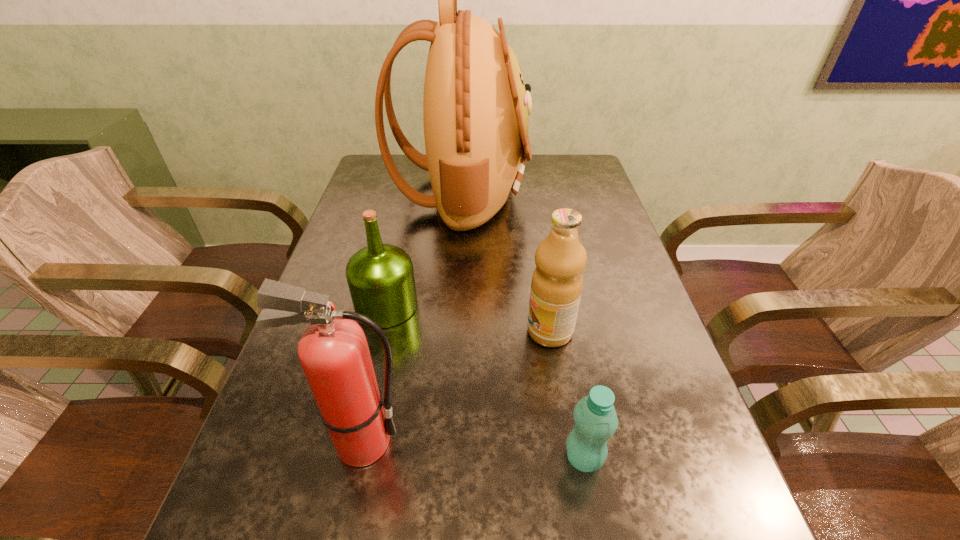
Where is `empty space that is in between the second tallest object and the bottle`? The width and height of the screenshot is (960, 540). empty space that is in between the second tallest object and the bottle is located at coordinates (472, 450).

You are a GUI agent. You are given a task and a screenshot of the screen. Output one action in this format:
    pyautogui.click(x=<x>, y=<y>)
    Task: Click on the free point between the third tallest object and the bottle
    This screenshot has height=540, width=960.
    Given the screenshot: What is the action you would take?
    pyautogui.click(x=566, y=395)

Select which object is the closest to the taller olive oil. Please provide its 2D coordinates. Your answer should be formatted as a tuple, i.e. [(x, y)], where the tuple contains the x and y coordinates of a point satisfying the conditions above.

[(596, 421)]

This screenshot has width=960, height=540. Find the location of `object that is the third closest to the shortest object`. object that is the third closest to the shortest object is located at coordinates (380, 277).

Identify the location of free spot that satisfies the following two spatial constraints: 1. on the hose direction of the fire extinguisher; 2. on the back side of the bottle. (358, 458).

Locate an element on the screen. This screenshot has width=960, height=540. free space that satisfies the following two spatial constraints: 1. on the back side of the shortest object; 2. on the hose direction of the fourth shortest object is located at coordinates (581, 442).

Image resolution: width=960 pixels, height=540 pixels. In order to click on vacant area in the image that satisfies the following two spatial constraints: 1. on the hose direction of the shortest object; 2. on the right side of the fire extinguisher in this screenshot , I will do `click(358, 458)`.

Find the location of a particular element. The height and width of the screenshot is (540, 960). blank area in the image that satisfies the following two spatial constraints: 1. on the hose direction of the bottle; 2. on the right side of the second tallest object is located at coordinates (358, 458).

The width and height of the screenshot is (960, 540). Identify the location of free location that satisfies the following two spatial constraints: 1. on the front-facing side of the shortest object; 2. on the left side of the backpack. (443, 458).

You are a GUI agent. You are given a task and a screenshot of the screen. Output one action in this format:
    pyautogui.click(x=<x>, y=<y>)
    Task: Click on the free space that satisfies the following two spatial constraints: 1. on the label of the right olive oil; 2. on the back side of the shortest object
    This screenshot has height=540, width=960.
    Given the screenshot: What is the action you would take?
    pyautogui.click(x=570, y=458)